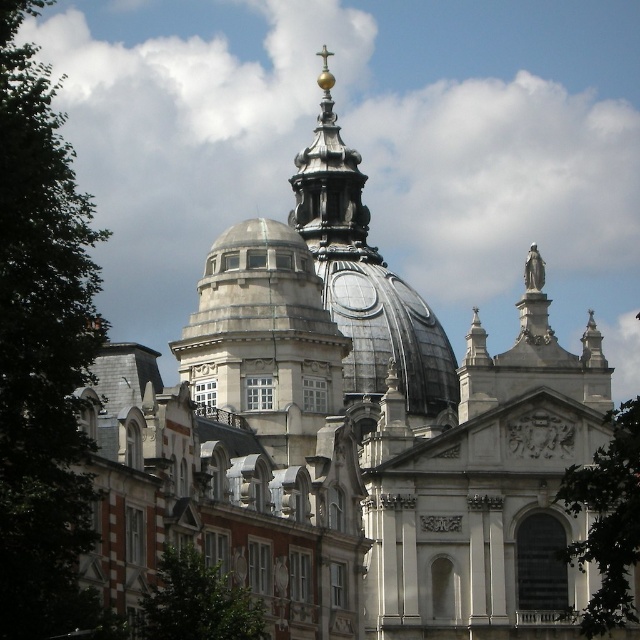
Question: Does silver metallic dome at center appear on the right side of gold-plated metal cross at upper center?

Choices:
 (A) no
 (B) yes

Answer: (A)

Question: Can you confirm if silver metallic dome at center is positioned to the right of gold-plated metal cross at upper center?

Choices:
 (A) yes
 (B) no

Answer: (B)

Question: Is silver metallic dome at center above gold-plated metal cross at upper center?

Choices:
 (A) yes
 (B) no

Answer: (B)

Question: Among these objects, which one is nearest to the camera?

Choices:
 (A) silver metallic dome at center
 (B) gold-plated metal cross at upper center

Answer: (A)